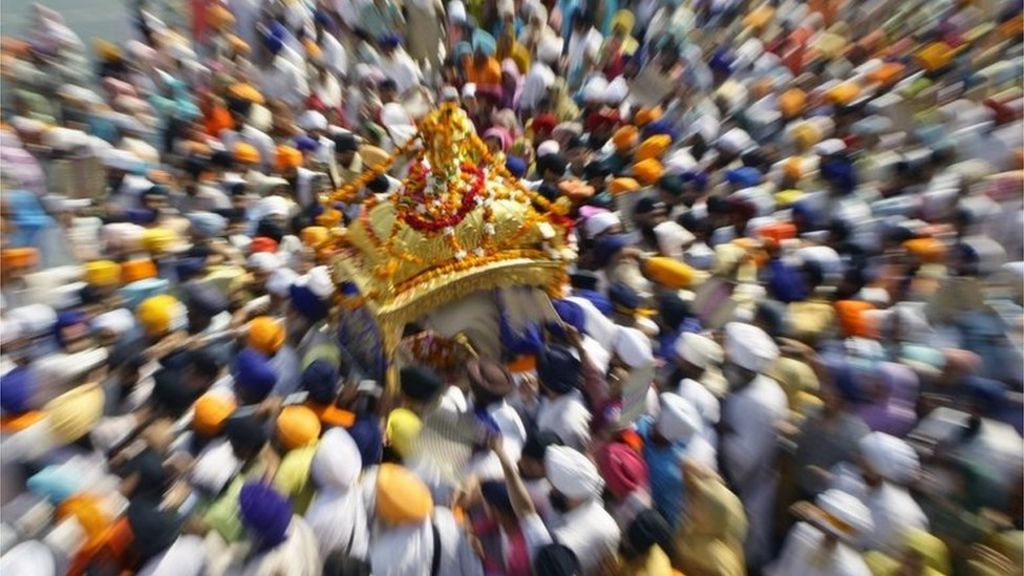
Where is `red flower garland`? The width and height of the screenshot is (1024, 576). red flower garland is located at coordinates (463, 206).